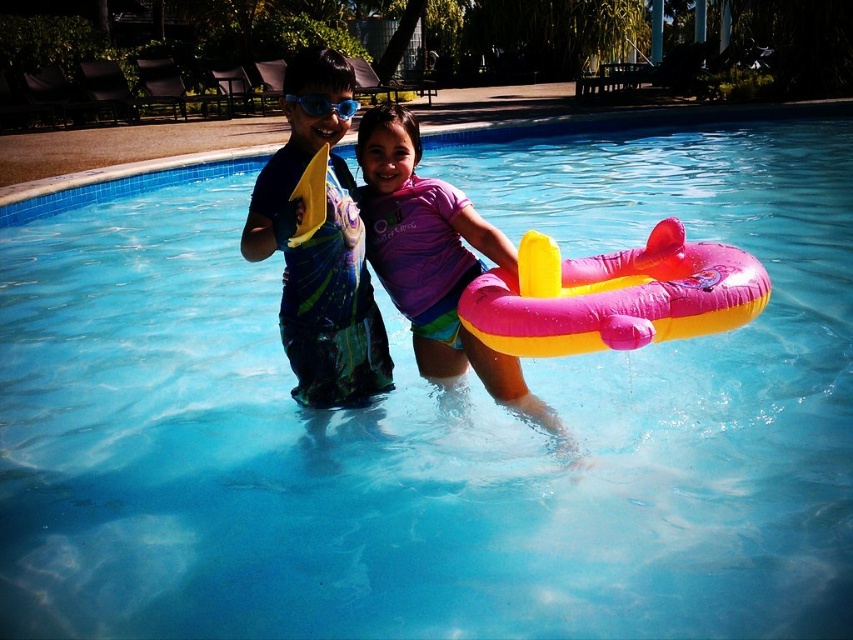
Is point (653, 273) farther from camera compared to point (381, 138)?

Yes, it is behind point (381, 138).

What do you see at coordinates (613, 296) in the screenshot? This screenshot has width=853, height=640. I see `pink rubber float at center` at bounding box center [613, 296].

Which is behind, point (651, 307) or point (399, 156)?

The point (399, 156) is more distant.

Where is `pink rubber float at center`? The image size is (853, 640). pink rubber float at center is located at coordinates (613, 296).

Is blue-green swim trunks at center thinner than pink rubber float at center?

Correct, blue-green swim trunks at center's width is less than pink rubber float at center's.

Describe the element at coordinates (320, 278) in the screenshot. I see `blue-green swim trunks at center` at that location.

At what (x,y) coordinates should I click in order to perform the action: click on blue-green swim trunks at center. Please return your answer as a coordinate pair (x, y). Image resolution: width=853 pixels, height=640 pixels. Looking at the image, I should click on (320, 278).

Is point (361, 256) farther from viewer compared to point (323, 112)?

That is True.

What do you see at coordinates (320, 278) in the screenshot? I see `blue-green swim trunks at center` at bounding box center [320, 278].

Does point (379, 380) come closer to viewer compared to point (294, 99)?

No.

Image resolution: width=853 pixels, height=640 pixels. I want to click on blue-green swim trunks at center, so (320, 278).